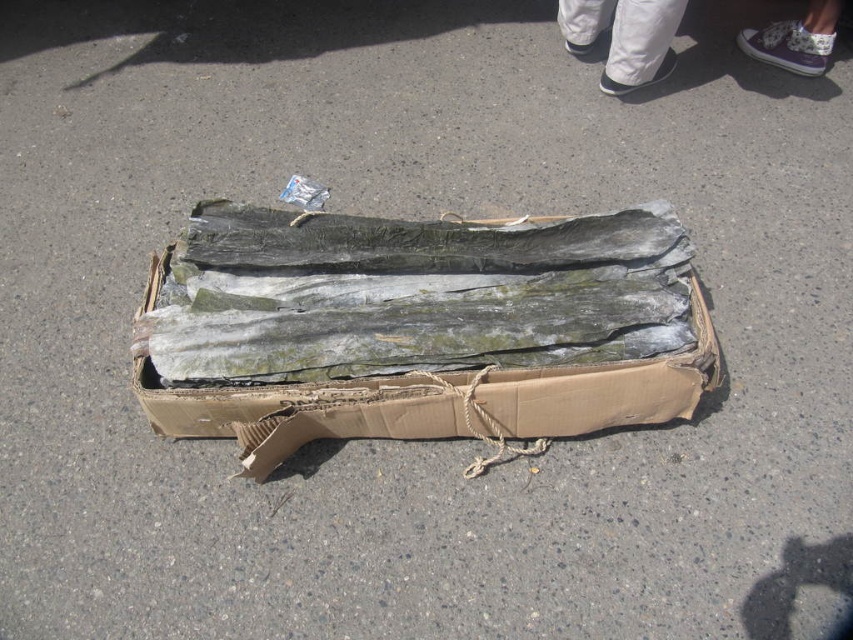
You are standing at the point with coordinates point (585, 45) and want to walk to the point with coordinates point (496, 268). Which direction should you move to reach your destination?

Point (496, 268) is in front of point (585, 45), so you should move forward to reach your destination.